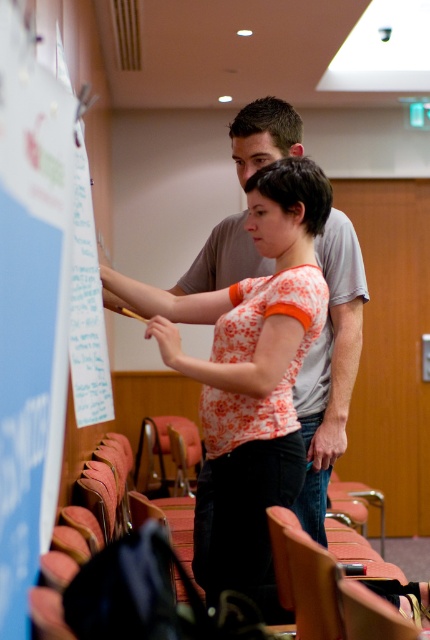
Question: Does floral cotton shirt at center have a smaller size compared to white paper at left?

Choices:
 (A) yes
 (B) no

Answer: (B)

Question: Which object appears closest to the camera in this image?

Choices:
 (A) white paper at left
 (B) floral cotton shirt at center

Answer: (A)

Question: Observing the image, what is the correct spatial positioning of floral cotton shirt at center in reference to white paper at left?

Choices:
 (A) below
 (B) above

Answer: (A)

Question: Does floral cotton shirt at center have a lesser width compared to white paper at left?

Choices:
 (A) no
 (B) yes

Answer: (A)

Question: Which point appears farthest from the camera in this image?

Choices:
 (A) (214, 349)
 (B) (3, 195)

Answer: (A)

Question: Which point is farther from the camera taking this photo?

Choices:
 (A) (202, 484)
 (B) (12, 419)

Answer: (A)